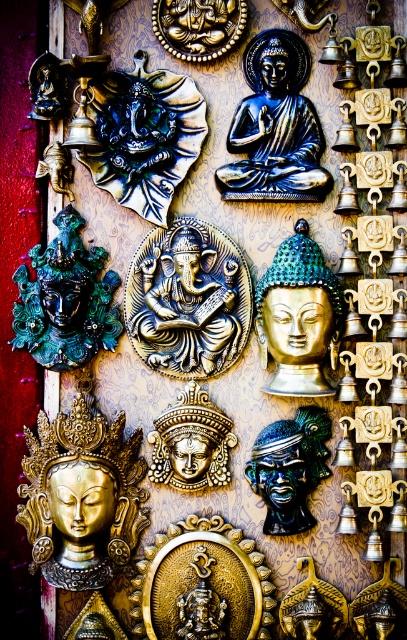
The height and width of the screenshot is (640, 407). What do you see at coordinates (297, 316) in the screenshot? I see `gold/golden metallic buddha head at center` at bounding box center [297, 316].

Who is shorter, gold/golden metallic buddha head at center or gold polished statue at center?

Standing shorter between the two is gold polished statue at center.

Who is more forward, (317, 312) or (391, 628)?

Point (317, 312) is more forward.

At what (x,y) coordinates should I click in order to perform the action: click on gold/golden metallic buddha head at center. Please return your answer as a coordinate pair (x, y). Looking at the image, I should click on coord(297,316).

Can you confirm if gold metallic ganesh at center is bigger than gold metallic bell at center?

Correct, gold metallic ganesh at center is larger in size than gold metallic bell at center.

Between point (231, 273) and point (308, 557), which one is positioned in front?

Point (231, 273) is in front.

Is point (225, 332) positioned behind point (332, 609)?

Yes, point (225, 332) is behind point (332, 609).

Image resolution: width=407 pixels, height=640 pixels. What are the coordinates of `gold metallic ganesh at center` in the screenshot? It's located at (188, 300).

Can you confirm if gold polished buddha at lower left is thinner than gold metallic ganesh at center?

In fact, gold polished buddha at lower left might be wider than gold metallic ganesh at center.

Is gold polished buddha at lower left to the right of gold metallic ganesh at center from the viewer's perspective?

Incorrect, gold polished buddha at lower left is not on the right side of gold metallic ganesh at center.

At what (x,y) coordinates should I click in order to perform the action: click on gold polished buddha at lower left. Please return your answer as a coordinate pair (x, y). Looking at the image, I should click on (81, 496).